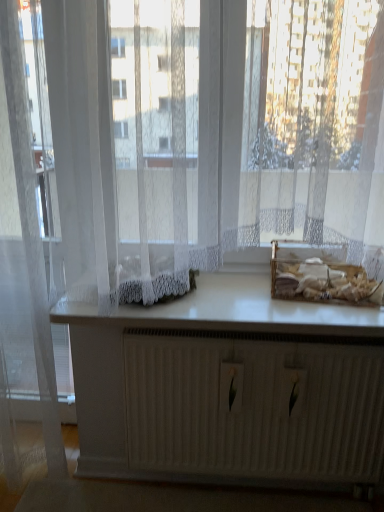
Question: Is translucent white curtain at left not within white smooth countertop at center?

Choices:
 (A) no
 (B) yes

Answer: (B)

Question: From the image's perspective, would you say translucent white curtain at left is shown under white smooth countertop at center?

Choices:
 (A) no
 (B) yes

Answer: (A)

Question: Does translucent white curtain at left have a smaller size compared to white smooth countertop at center?

Choices:
 (A) no
 (B) yes

Answer: (A)

Question: Would you say white smooth countertop at center is part of translucent white curtain at left's contents?

Choices:
 (A) yes
 (B) no

Answer: (B)

Question: Is translucent white curtain at left beside white smooth countertop at center?

Choices:
 (A) no
 (B) yes

Answer: (A)

Question: In terms of height, does translucent plastic basket at center look taller or shorter compared to white smooth countertop at center?

Choices:
 (A) short
 (B) tall

Answer: (B)

Question: Is translucent plastic basket at center to the left or to the right of white smooth countertop at center in the image?

Choices:
 (A) left
 (B) right

Answer: (B)

Question: Is translucent plastic basket at center in front of or behind white smooth countertop at center in the image?

Choices:
 (A) front
 (B) behind

Answer: (B)

Question: Is translucent plastic basket at center bigger or smaller than white smooth countertop at center?

Choices:
 (A) big
 (B) small

Answer: (B)

Question: Is point (94, 436) closer or farther from the camera than point (342, 67)?

Choices:
 (A) closer
 (B) farther

Answer: (B)

Question: Visually, is white matte radiator at center positioned to the left or to the right of white lace curtains at center?

Choices:
 (A) left
 (B) right

Answer: (B)

Question: Is white matte radiator at center wider or thinner than white lace curtains at center?

Choices:
 (A) thin
 (B) wide

Answer: (A)

Question: Considering their positions, is white matte radiator at center located in front of or behind white lace curtains at center?

Choices:
 (A) front
 (B) behind

Answer: (B)

Question: Looking at their shapes, would you say white matte radiator at center is wider or thinner than white smooth countertop at center?

Choices:
 (A) wide
 (B) thin

Answer: (B)

Question: From the image's perspective, is white matte radiator at center located above or below white smooth countertop at center?

Choices:
 (A) above
 (B) below

Answer: (B)